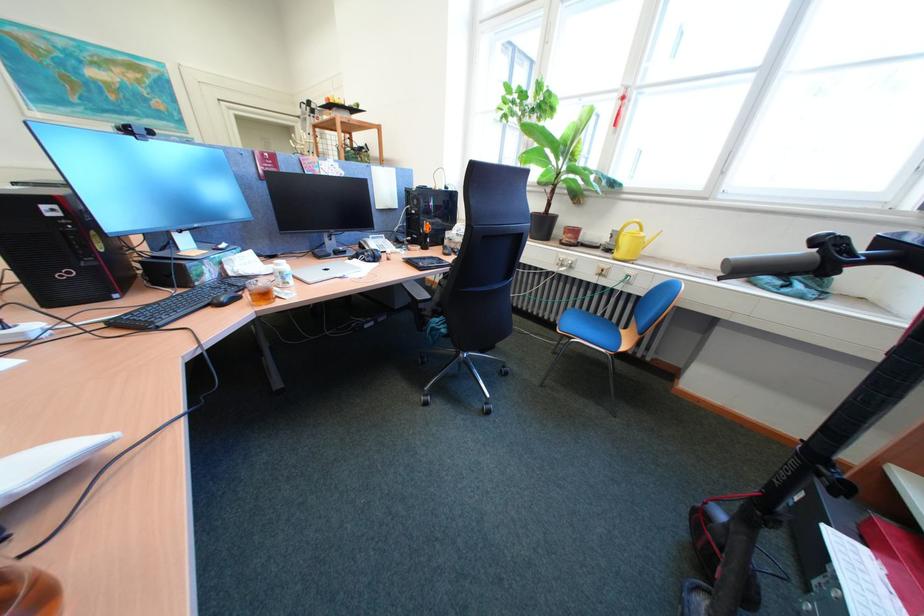
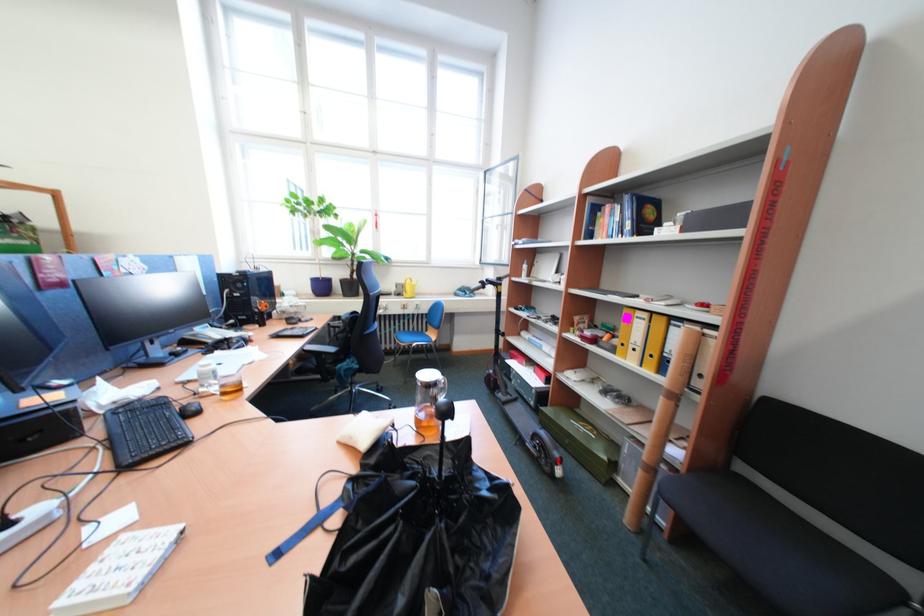
Locate, in the second image, the point that corresponds to (x=594, y=309) in the first image.

(415, 331)